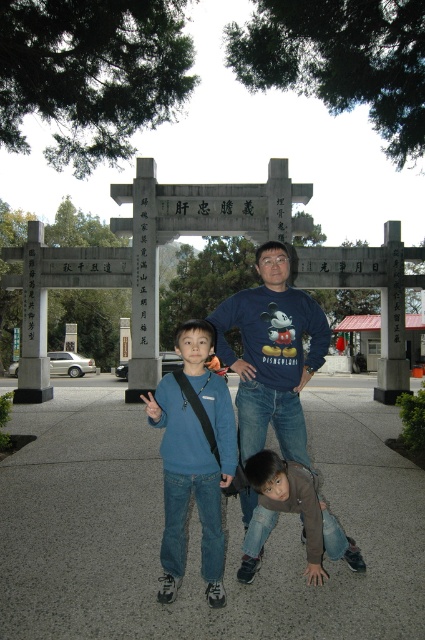
You are a photographer trying to capture a clear shot of the blue cotton shirt at center and the brown denim jeans at lower center. Which one should you focus on first if you want to ensure both are in focus?

The blue cotton shirt at center is located above the brown denim jeans at lower center, so focusing on the blue cotton shirt at center first will help ensure both are in focus since it is closer to the camera.

You are standing at the point with coordinates point [249,429] and want to take a photo of the archway. Is there any obstruction between you and the archway caused by the other point at point [292,481]?

Point [249,429] is behind point [292,481], so the point at [292,481] would block your view of the archway if you are standing at point [249,429].

You are a photographer taking a picture of the matte blue sweater at center and the brown denim jeans at lower center. Which object is covering the other?

The matte blue sweater at center is positioned over the brown denim jeans at lower center, so it is covering the other.